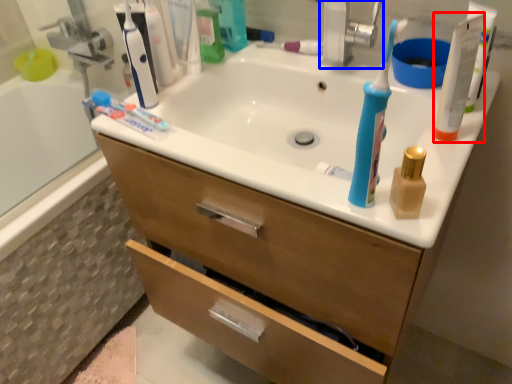
Question: Which object is further to the camera taking this photo, toiletry (highlighted by a red box) or faucet (highlighted by a blue box)?

Choices:
 (A) toiletry
 (B) faucet

Answer: (B)